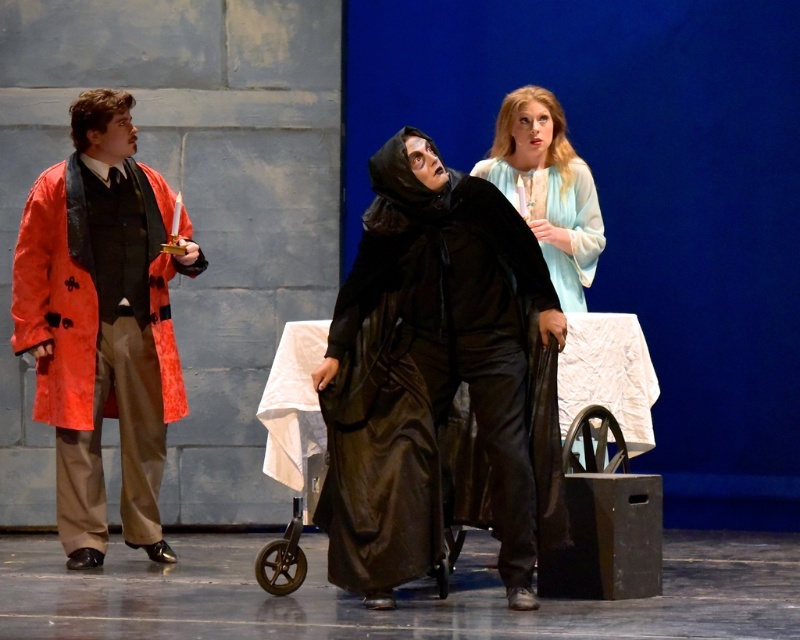
Based on the scene description, which object is smaller in size between the velvet black robe at center and the shiny red coat at left?

The velvet black robe at center is smaller than the shiny red coat at left according to the description.

Consider the image. You are a stagehand setting up a spotlight. The spotlight can only cover objects wider than 1 meter. You need to decide whether to aim it at the shiny red coat at left or the light blue silk dress at center. Which one should you choose based on their widths?

The shiny red coat at left is wider than the light blue silk dress at center, so you should aim the spotlight at the shiny red coat at left since it is wider and likely exceeds the 1 meter requirement.